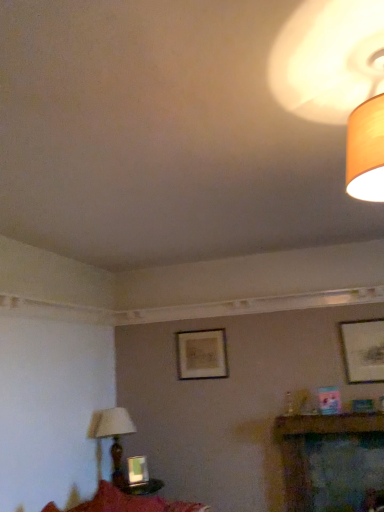
Question: Is wooden lampshade at lower left, arranged as the first lamp when ordered from the bottom, in front of or behind matte black picture frame at upper right, the 3th picture frame in the back-to-front sequence, in the image?

Choices:
 (A) front
 (B) behind

Answer: (A)

Question: From a real-world perspective, is wooden lampshade at lower left, the second lamp positioned from the top, above or below matte black picture frame at upper right, which ranks as the 3th picture frame in bottom-to-top order?

Choices:
 (A) above
 (B) below

Answer: (B)

Question: Considering the real-world distances, which object is closest to the matte beige lampshade at upper right, the 2th lamp from the bottom?

Choices:
 (A) matte black picture frame at upper right, which is counted as the 1th picture frame, starting from the front
 (B) wooden lampshade at lower left, which ranks as the 1th lamp in left-to-right order
 (C) matte wooden picture frame at center, the 1th picture frame in the back-to-front sequence
 (D) metallic silver picture frame at lower center, which ranks as the first picture frame in left-to-right order

Answer: (A)

Question: Which object is positioned closest to the matte beige lampshade at upper right, which is the second lamp from back to front?

Choices:
 (A) matte wooden picture frame at center, arranged as the 2th picture frame when viewed from the top
 (B) matte black picture frame at upper right, the 3th picture frame in the back-to-front sequence
 (C) metallic silver picture frame at lower center, the third picture frame when ordered from right to left
 (D) wooden lampshade at lower left, which appears as the first lamp when viewed from the back

Answer: (B)